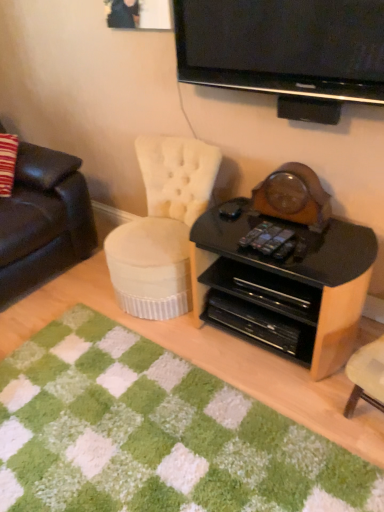
Identify the location of free area below green shaggy rug at lower center (from a real-world perspective). (141, 438).